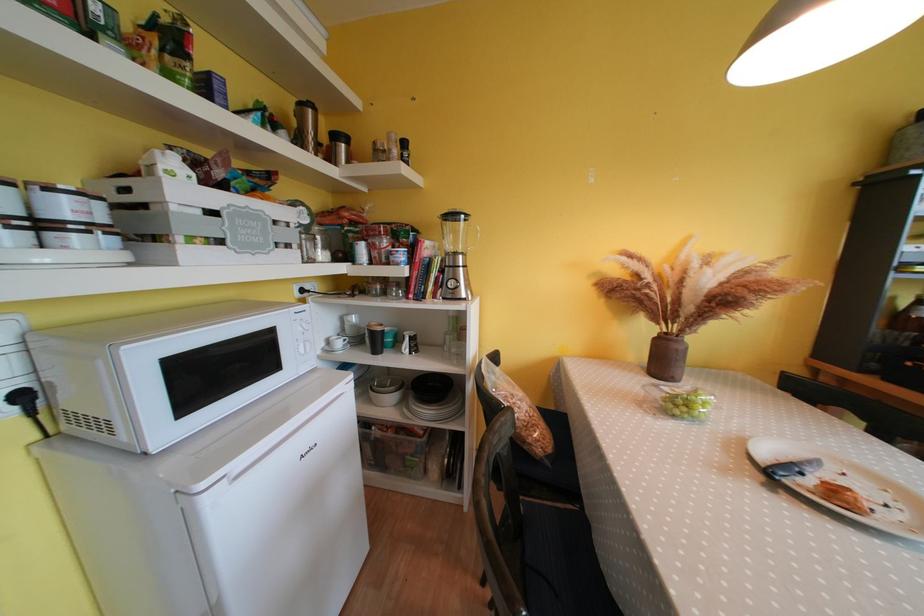
Find where to pull the white refrigerator handle. Please return your answer as a coordinate pair (x, y).

(286, 437)